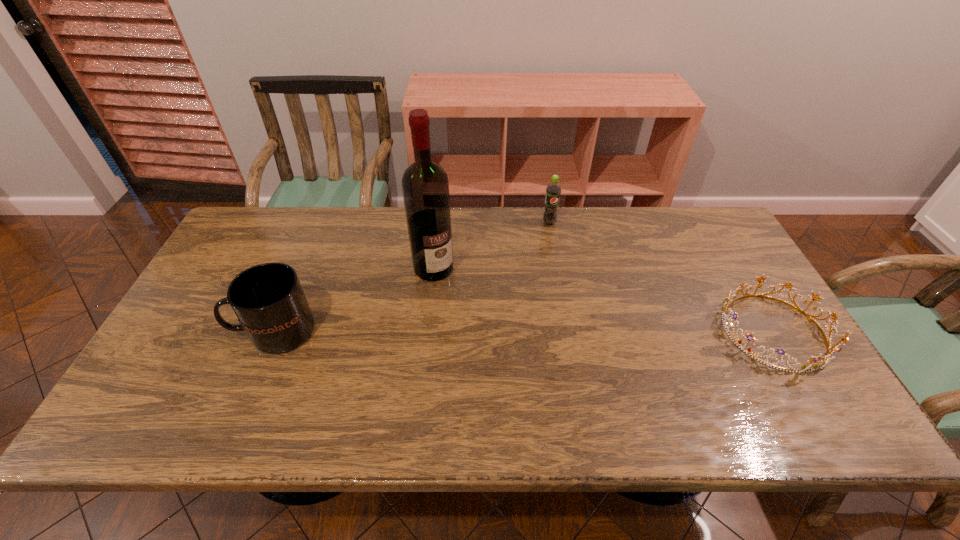
Where is `blank space located on the front label of the soda`? This screenshot has width=960, height=540. blank space located on the front label of the soda is located at coordinates (556, 237).

In order to click on vacant region located 0.320m on the front label of the soda in this screenshot , I will do `click(582, 298)`.

I want to click on free spot located 0.310m on the front label of the soda, so click(x=581, y=295).

This screenshot has height=540, width=960. I want to click on vacant space situated on the front and back of the alcohol, so click(x=528, y=380).

Locate an element on the screen. vacant area located 0.080m on the front and back of the alcohol is located at coordinates (458, 297).

I want to click on free spot located on the front and back of the alcohol, so click(511, 360).

The image size is (960, 540). What are the coordinates of `object located in the far edge section of the desktop` in the screenshot? It's located at 553,190.

Find the location of a particular element. Image resolution: width=960 pixels, height=540 pixels. object located in the near edge section of the desktop is located at coordinates (811, 366).

You are a GUI agent. You are given a task and a screenshot of the screen. Output one action in this format:
    pyautogui.click(x=<x>, y=<y>)
    Task: Click on the object that is positioned at the left edge
    The width and height of the screenshot is (960, 540).
    Given the screenshot: What is the action you would take?
    pyautogui.click(x=268, y=300)

You are a GUI agent. You are given a task and a screenshot of the screen. Output one action in this format:
    pyautogui.click(x=<x>, y=<y>)
    Task: Click on the object positioned at the right edge
    The height and width of the screenshot is (540, 960).
    Given the screenshot: What is the action you would take?
    pyautogui.click(x=811, y=366)